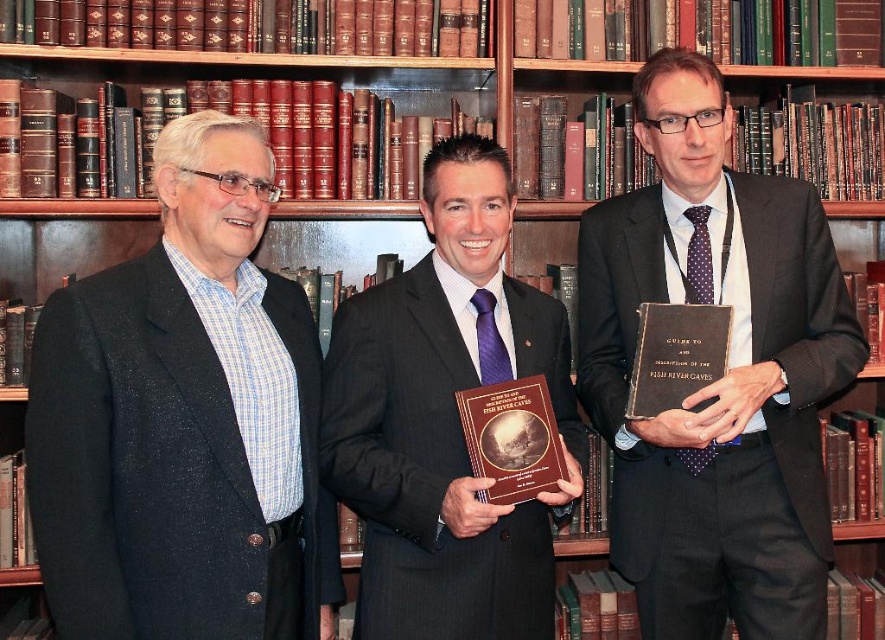
Question: Can you confirm if matte black suit at left is positioned to the left of matte black book at center?

Choices:
 (A) no
 (B) yes

Answer: (B)

Question: Does matte black book at center have a greater width compared to matte black suit at center?

Choices:
 (A) no
 (B) yes

Answer: (B)

Question: Which point appears closest to the camera in this image?

Choices:
 (A) (826, 227)
 (B) (137, 342)
 (C) (364, 346)

Answer: (B)

Question: Which point is closer to the camera?

Choices:
 (A) (295, 301)
 (B) (740, 349)

Answer: (A)

Question: Can you confirm if matte black suit at left is positioned to the left of matte black suit at center?

Choices:
 (A) yes
 (B) no

Answer: (A)

Question: Which of the following is the closest to the observer?

Choices:
 (A) (298, 508)
 (B) (690, 298)

Answer: (A)